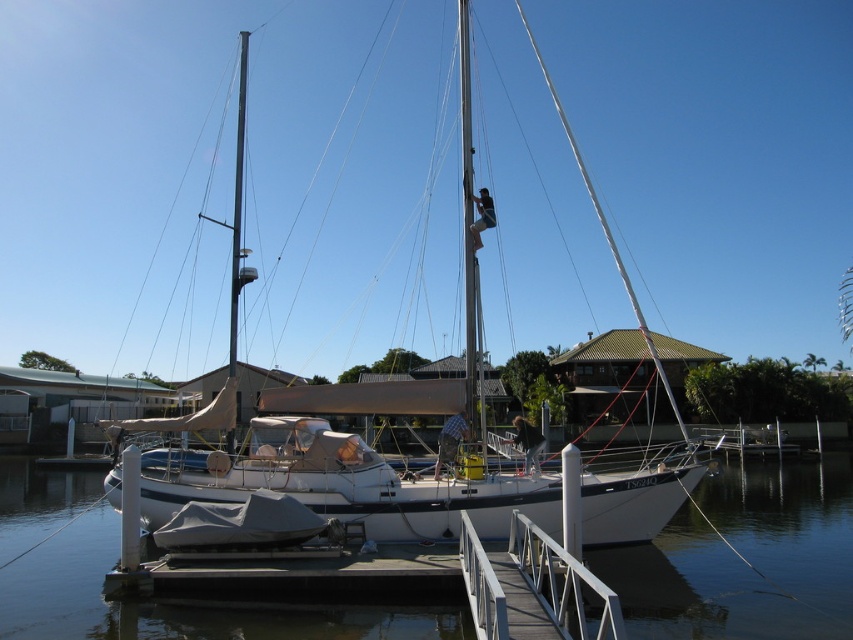
You are standing on the wooden pier and see the clear water at dock center and the white matte sailboat at center. Which object is positioned lower in the scene?

The clear water at dock center is located below the white matte sailboat at center, so it is positioned lower in the scene.

You are standing on the pier and want to board the white matte sailboat at center. The pier has a safety rule that you must stay at least 10 meters away from the boat to avoid damaging it. Are you currently within the safe distance?

The white matte sailboat at center is 11.43 meters away from camera, so yes, you are within the safe distance since 11.43 meters is more than the required 10 meters.

Consider the image. Based on the coordinates provided, what is located at point (x=746, y=556) in the marina scene?

The coordinates point to clear water at dock center.